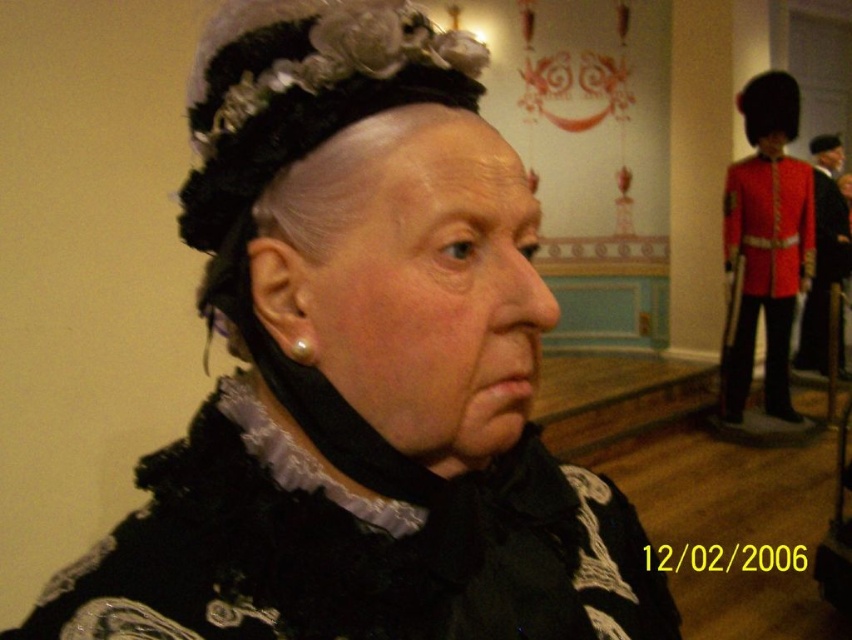
You are a photographer at a historical event. You need to capture a photo where the black velvet dress at center is visible above the red woolen uniform at right. Based on the scene description, is this possible?

The black velvet dress at center is below the red woolen uniform at right, so it cannot be visible above it in the current arrangement.

You are an event planner organizing a historical fashion show. You have two red garments displayed at the right side of the stage. The first is a red velvet jacket at right and the second is a red woolen uniform at right. According to the scene, which garment is closer to the center of the stage?

The red velvet jacket at right is positioned on the left side of the red woolen uniform at right, meaning it is closer to the center of the stage than the uniform.

You are an event planner organizing a historical fashion show. You have two garments to display side by side on mannequins. The black velvet dress at center and the red velvet jacket at right. Based on their sizes, which garment should be placed on a taller mannequin to ensure proper display?

The red velvet jacket at right should be placed on a taller mannequin because the black velvet dress at center is not as tall as the red velvet jacket at right.